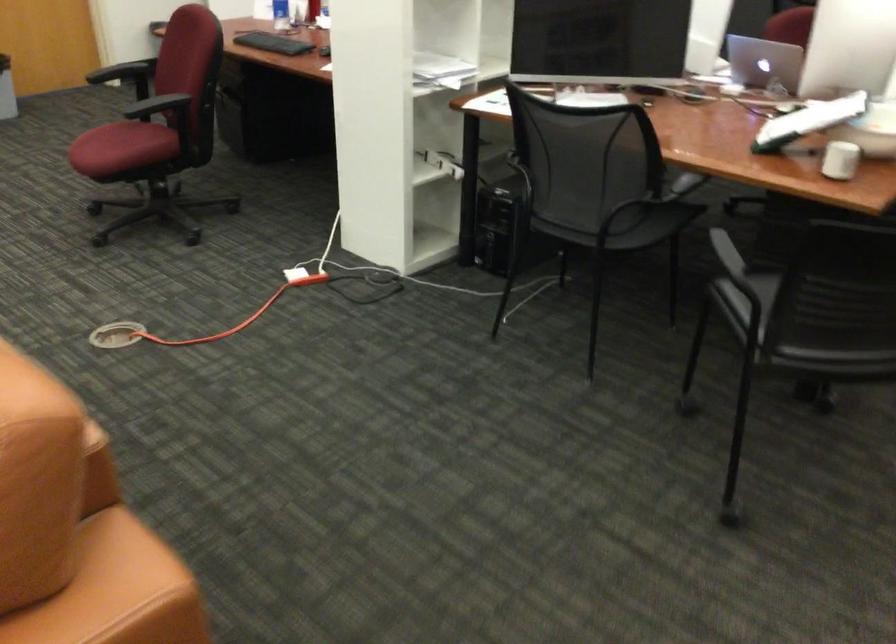
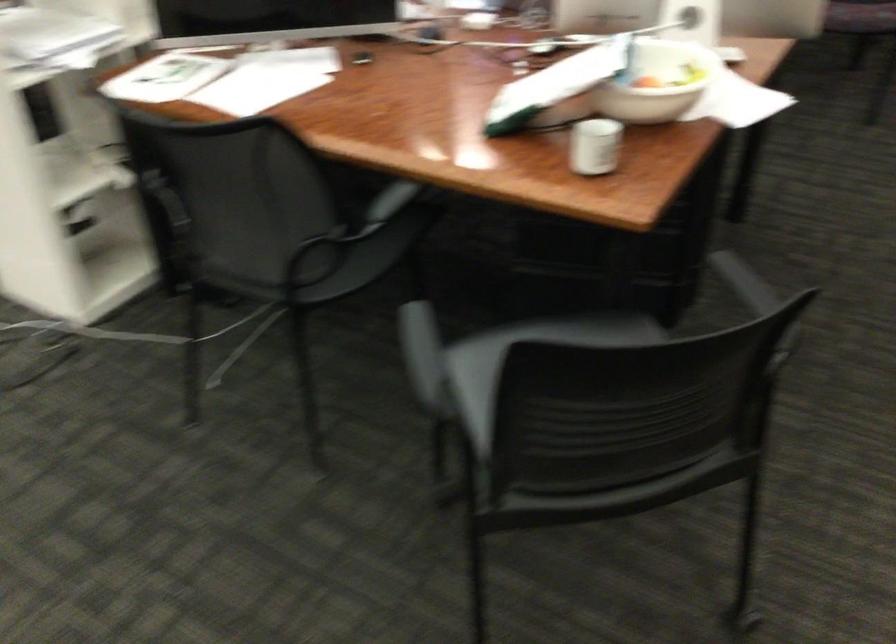
Question: The camera is either moving clockwise (left) or counter-clockwise (right) around the object. The first image is from the beginning of the video and the second image is from the end. Is the camera moving left or right when shooting the video?

Choices:
 (A) Left
 (B) Right

Answer: (A)